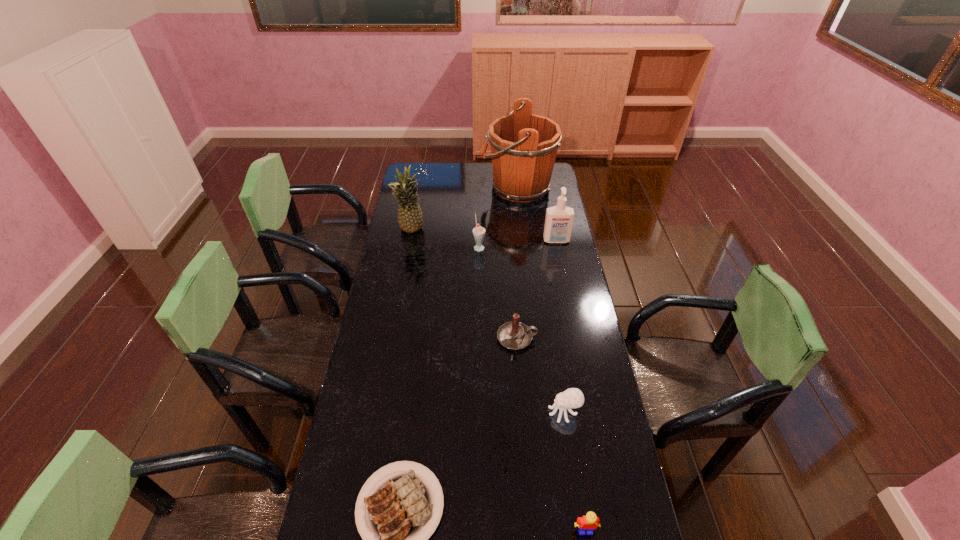
The width and height of the screenshot is (960, 540). What are the coordinates of `vacant region located with the handle on the side of the bucket` in the screenshot? It's located at (461, 187).

The width and height of the screenshot is (960, 540). I want to click on blank area located 0.360m on the right of the seventh shortest object, so click(499, 231).

The width and height of the screenshot is (960, 540). I want to click on free space located on the front label of the sixth shortest object, so click(x=561, y=265).

Identify the location of free space located 0.200m on the straw side of the milkshake. Image resolution: width=960 pixels, height=540 pixels. (529, 247).

Locate an element on the screen. This screenshot has height=540, width=960. free space located on the side of the fifth farthest object with the handle loop is located at coordinates pyautogui.click(x=585, y=338).

Find the location of a particular element. vacant area situated on the front-facing side of the sixth farthest object is located at coordinates (481, 412).

Locate an element on the screen. Image resolution: width=960 pixels, height=540 pixels. free space located on the front-facing side of the sixth farthest object is located at coordinates (515, 412).

The width and height of the screenshot is (960, 540). In order to click on free space located on the front-facing side of the sixth farthest object in this screenshot , I will do `click(442, 412)`.

Locate an element on the screen. This screenshot has height=540, width=960. object present at the far edge is located at coordinates (524, 146).

Identify the location of object at the left edge. (410, 216).